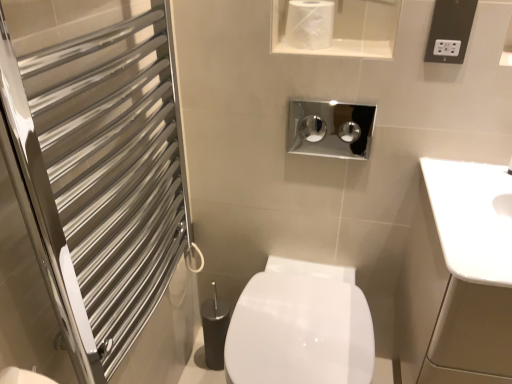
Measure the distance between silver metallic towel rack at left and camera.

silver metallic towel rack at left is 59.58 centimeters from camera.

Locate an element on the screen. This screenshot has width=512, height=384. white glossy bidet at center is located at coordinates (298, 332).

Measure the distance between white glossy bidet at center and camera.

A distance of 37.64 inches exists between white glossy bidet at center and camera.

What is the approximate height of black plastic electrical outlet at upper right?

5.75 inches.

The image size is (512, 384). In order to click on black plastic electrical outlet at upper right in this screenshot , I will do `click(450, 31)`.

Where is `white glossy toilet paper at upper center`? The width and height of the screenshot is (512, 384). white glossy toilet paper at upper center is located at coordinates (309, 24).

I want to click on silver metallic towel rack at left, so click(x=99, y=165).

From a real-world perspective, is black plastic electrical outlet at upper right located beneath white glossy toilet paper at upper center?

No.

Measure the distance between black plastic electrical outlet at upper right and white glossy toilet paper at upper center.

black plastic electrical outlet at upper right is 11.36 inches away from white glossy toilet paper at upper center.

Is white glossy toilet paper at upper center at the back of black plastic electrical outlet at upper right?

No, black plastic electrical outlet at upper right is not facing away from white glossy toilet paper at upper center.

Considering the sizes of objects black plastic electrical outlet at upper right and white glossy toilet paper at upper center in the image provided, who is thinner, black plastic electrical outlet at upper right or white glossy toilet paper at upper center?

Thinner between the two is black plastic electrical outlet at upper right.

Does white glossy toilet paper at upper center lie in front of white glossy bidet at center?

No, it is behind white glossy bidet at center.

Which is in front, point (320, 38) or point (272, 333)?

The point (272, 333) is in front.

Does white glossy toilet paper at upper center turn towards white glossy bidet at center?

No, white glossy toilet paper at upper center is not facing towards white glossy bidet at center.

Does white glossy toilet paper at upper center have a larger size compared to white glossy bidet at center?

Incorrect, white glossy toilet paper at upper center is not larger than white glossy bidet at center.

Is silver metallic towel rack at left at the left side of black plastic electrical outlet at upper right?

Yes.

Considering the sizes of objects silver metallic towel rack at left and black plastic electrical outlet at upper right in the image provided, who is taller, silver metallic towel rack at left or black plastic electrical outlet at upper right?

silver metallic towel rack at left.

Could white glossy toilet paper at upper center be considered to be inside silver metallic towel rack at left?

No, white glossy toilet paper at upper center is not inside silver metallic towel rack at left.

Is silver metallic towel rack at left positioned in front of white glossy toilet paper at upper center?

Yes, silver metallic towel rack at left is closer to the viewer.

Is black plastic electrical outlet at upper right next to silver metallic towel rack at left?

black plastic electrical outlet at upper right and silver metallic towel rack at left are clearly separated.

Consider the image. Can you confirm if black plastic electrical outlet at upper right is positioned to the right of silver metallic towel rack at left?

Yes, black plastic electrical outlet at upper right is to the right of silver metallic towel rack at left.

Who is smaller, black plastic electrical outlet at upper right or silver metallic towel rack at left?

Smaller between the two is black plastic electrical outlet at upper right.

From a real-world perspective, is black plastic electrical outlet at upper right under silver metallic towel rack at left?

No, from a real-world perspective, black plastic electrical outlet at upper right is not under silver metallic towel rack at left.

Is white glossy bidet at center looking in the opposite direction of white glossy toilet paper at upper center?

No, white glossy bidet at center's orientation is not away from white glossy toilet paper at upper center.

Find the location of `toilet paper above the white glossy bidet at center (from the image's perspective)`. toilet paper above the white glossy bidet at center (from the image's perspective) is located at coordinates (309, 24).

Which of these two, white glossy bidet at center or white glossy toilet paper at upper center, is thinner?

white glossy toilet paper at upper center.

Visually, is white glossy bidet at center positioned to the left or to the right of silver metallic towel rack at left?

Clearly, white glossy bidet at center is on the right of silver metallic towel rack at left in the image.

Looking at this image, considering the sizes of objects white glossy bidet at center and silver metallic towel rack at left in the image provided, who is shorter, white glossy bidet at center or silver metallic towel rack at left?

white glossy bidet at center is shorter.

From the image's perspective, which is above, white glossy bidet at center or silver metallic towel rack at left?

silver metallic towel rack at left is shown above in the image.

Considering the points (289, 364) and (64, 31), which point is behind, point (289, 364) or point (64, 31)?

The point (289, 364) is farther from the camera.

This screenshot has height=384, width=512. I want to click on toilet paper on the left of the black plastic electrical outlet at upper right, so click(309, 24).

Locate an element on the screen. This screenshot has width=512, height=384. bidet located below the white glossy toilet paper at upper center (from the image's perspective) is located at coordinates (298, 332).

Which object lies further to the anchor point silver metallic towel rack at left, white glossy bidet at center or black plastic electrical outlet at upper right?

The object further to silver metallic towel rack at left is black plastic electrical outlet at upper right.

Looking at this image, looking at the image, which one is located further to black plastic electrical outlet at upper right, silver metallic towel rack at left or white glossy bidet at center?

silver metallic towel rack at left is further to black plastic electrical outlet at upper right.

From the image, which object appears to be farther from white glossy toilet paper at upper center, white glossy bidet at center or black plastic electrical outlet at upper right?

Among the two, white glossy bidet at center is located further to white glossy toilet paper at upper center.

Considering their positions, is silver metallic towel rack at left positioned closer to white glossy toilet paper at upper center than black plastic electrical outlet at upper right?

black plastic electrical outlet at upper right is positioned closer to the anchor white glossy toilet paper at upper center.

When comparing their distances from white glossy bidet at center, does black plastic electrical outlet at upper right or silver metallic towel rack at left seem further?

Among the two, black plastic electrical outlet at upper right is located further to white glossy bidet at center.

Based on their spatial positions, is black plastic electrical outlet at upper right or white glossy toilet paper at upper center further from silver metallic towel rack at left?

black plastic electrical outlet at upper right lies further to silver metallic towel rack at left than the other object.

When comparing their distances from black plastic electrical outlet at upper right, does silver metallic towel rack at left or white glossy toilet paper at upper center seem closer?

Based on the image, white glossy toilet paper at upper center appears to be nearer to black plastic electrical outlet at upper right.

Considering their positions, is white glossy bidet at center positioned closer to black plastic electrical outlet at upper right than white glossy toilet paper at upper center?

white glossy toilet paper at upper center lies closer to black plastic electrical outlet at upper right than the other object.

Identify the location of screen door that lies between white glossy toilet paper at upper center and white glossy bidet at center from top to bottom. This screenshot has width=512, height=384. (99, 165).

Where is `electric outlet between white glossy toilet paper at upper center and white glossy bidet at center vertically`? electric outlet between white glossy toilet paper at upper center and white glossy bidet at center vertically is located at coordinates (450, 31).

At what (x,y) coordinates should I click in order to perform the action: click on toilet paper between silver metallic towel rack at left and black plastic electrical outlet at upper right. Please return your answer as a coordinate pair (x, y). The image size is (512, 384). Looking at the image, I should click on click(309, 24).

You are a GUI agent. You are given a task and a screenshot of the screen. Output one action in this format:
    pyautogui.click(x=<x>, y=<y>)
    Task: Click on the screen door that lies between black plastic electrical outlet at upper right and white glossy bidet at center from top to bottom
    
    Given the screenshot: What is the action you would take?
    pyautogui.click(x=99, y=165)